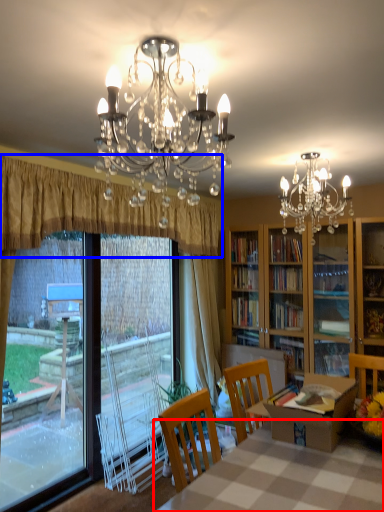
Question: Which of the following is the closest to the observer, table (highlighted by a red box) or curtain (highlighted by a blue box)?

Choices:
 (A) table
 (B) curtain

Answer: (A)